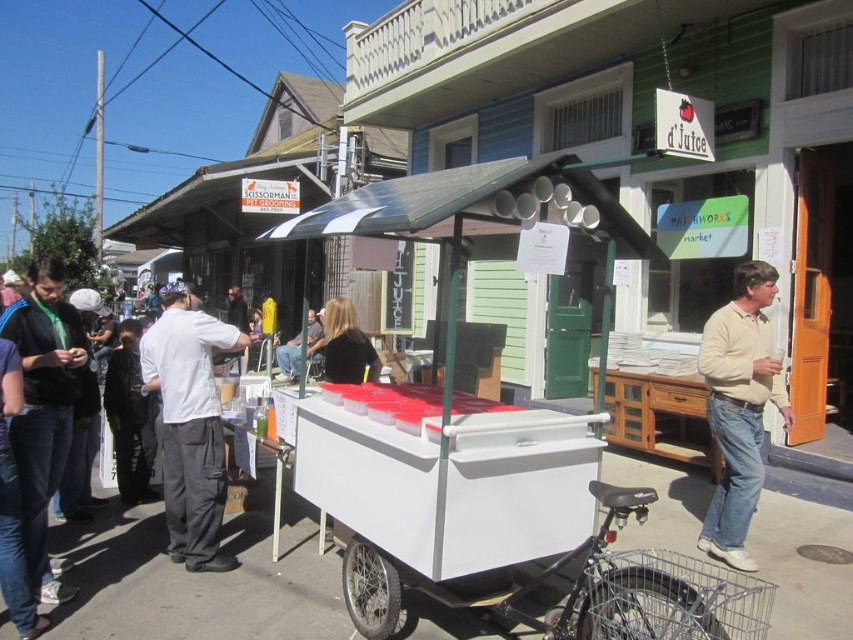
You are a customer at the market and want to buy a white cotton shirt at center. Where should you go to find it?

The white cotton shirt at center is located at the coordinates point (190, 426).

You are standing at the juice cart and want to hand a customer a matte black jacket at left. In which direction should you move to reach it?

The matte black jacket at left is located at point (x=44, y=408), so you should move to the left to reach it.

You are a customer at the market and want to try on the white cotton shirt at center and the matte black jacket at left. Which clothing item should you approach first if you want to start with the one closer to the juice cart?

The white cotton shirt at center is to the right of the matte black jacket at left. Since the juice cart is positioned on the paved street and the shirt is closer to it, you should start with the white cotton shirt at center.